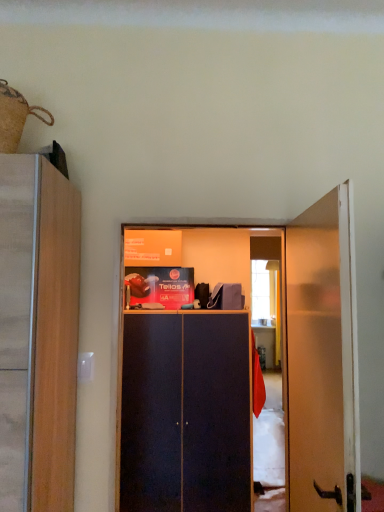
Question: Does dark wood cabinet at center appear on the left side of burlap sack at upper left?

Choices:
 (A) yes
 (B) no

Answer: (B)

Question: Is dark wood cabinet at center facing towards burlap sack at upper left?

Choices:
 (A) no
 (B) yes

Answer: (A)

Question: Is dark wood cabinet at center positioned with its back to burlap sack at upper left?

Choices:
 (A) no
 (B) yes

Answer: (A)

Question: Considering the relative positions of dark wood cabinet at center and burlap sack at upper left in the image provided, is dark wood cabinet at center behind burlap sack at upper left?

Choices:
 (A) no
 (B) yes

Answer: (B)

Question: Is dark wood cabinet at center wider than burlap sack at upper left?

Choices:
 (A) no
 (B) yes

Answer: (B)

Question: Considering the positions of dark wood cabinet at center and wooden door at right in the image, is dark wood cabinet at center wider or thinner than wooden door at right?

Choices:
 (A) thin
 (B) wide

Answer: (B)

Question: Would you say dark wood cabinet at center is inside or outside wooden door at right?

Choices:
 (A) outside
 (B) inside

Answer: (A)

Question: Is point (203, 344) positioned closer to the camera than point (344, 359)?

Choices:
 (A) closer
 (B) farther

Answer: (B)

Question: From the image's perspective, relative to wooden door at right, is dark wood cabinet at center above or below?

Choices:
 (A) above
 (B) below

Answer: (B)

Question: Would you say wooden door at right is to the left or to the right of dark wood cabinet at center in the picture?

Choices:
 (A) right
 (B) left

Answer: (A)

Question: From their relative heights in the image, would you say wooden door at right is taller or shorter than dark wood cabinet at center?

Choices:
 (A) tall
 (B) short

Answer: (B)

Question: In the image, is wooden door at right positioned in front of or behind dark wood cabinet at center?

Choices:
 (A) behind
 (B) front

Answer: (B)

Question: From the image's perspective, is wooden door at right positioned above or below dark wood cabinet at center?

Choices:
 (A) below
 (B) above

Answer: (B)

Question: Considering the relative positions of wooden door at right and burlap sack at upper left in the image provided, is wooden door at right to the left or to the right of burlap sack at upper left?

Choices:
 (A) right
 (B) left

Answer: (A)

Question: From their relative heights in the image, would you say wooden door at right is taller or shorter than burlap sack at upper left?

Choices:
 (A) tall
 (B) short

Answer: (A)